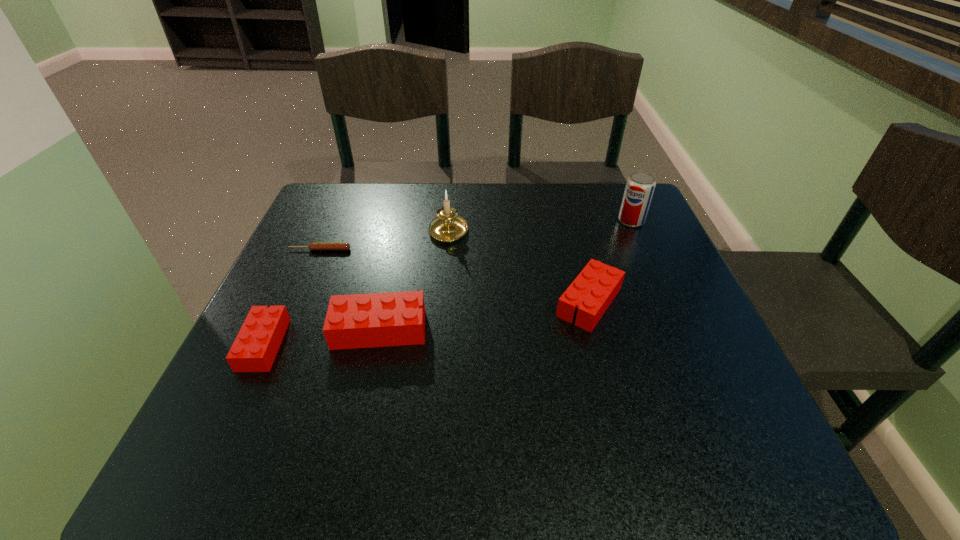
If equal spacing is the goal by inserting an additional Lego among them, please point out a vacant space for this new Lego. Please provide its 2D coordinates. Your answer should be formatted as a tuple, i.e. [(x, y)], where the tuple contains the x and y coordinates of a point satisfying the conditions above.

[(488, 315)]